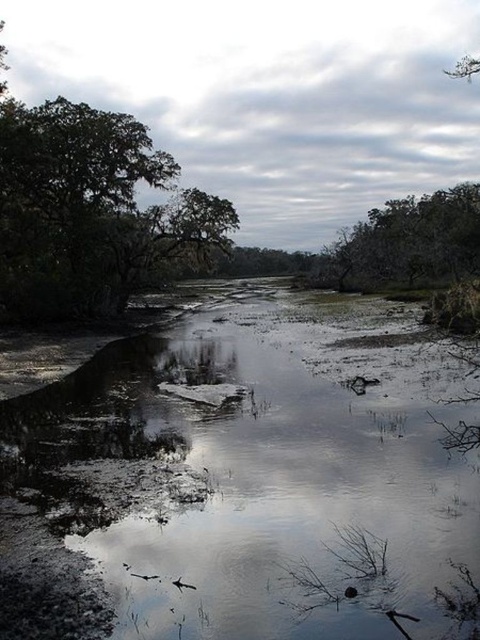
Is point (222, 212) closer to camera compared to point (470, 230)?

Yes, point (222, 212) is in front of point (470, 230).

Who is more forward, (140, 248) or (403, 253)?

Positioned in front is point (140, 248).

The width and height of the screenshot is (480, 640). In order to click on green leafy tree at upper left in this screenshot , I will do `click(91, 211)`.

Between muddy water at center and green leafy tree at upper right, which one has more height?

With more height is green leafy tree at upper right.

Can you confirm if muddy water at center is positioned to the right of green leafy tree at upper right?

No, muddy water at center is not to the right of green leafy tree at upper right.

Who is more forward, (x=0, y=435) or (x=376, y=275)?

Positioned in front is point (x=0, y=435).

You are a GUI agent. You are given a task and a screenshot of the screen. Output one action in this format:
    pyautogui.click(x=<x>, y=<y>)
    Task: Click on the muddy water at center
    
    Given the screenshot: What is the action you would take?
    pyautogui.click(x=238, y=480)

Does muddy water at center appear on the left side of green leafy tree at upper left?

No, muddy water at center is not to the left of green leafy tree at upper left.

This screenshot has height=640, width=480. What do you see at coordinates (238, 480) in the screenshot?
I see `muddy water at center` at bounding box center [238, 480].

Locate an element on the screen. This screenshot has height=640, width=480. muddy water at center is located at coordinates (238, 480).

The width and height of the screenshot is (480, 640). What are the coordinates of `muddy water at center` in the screenshot? It's located at click(238, 480).